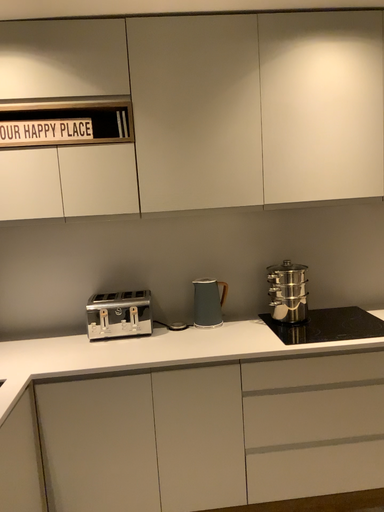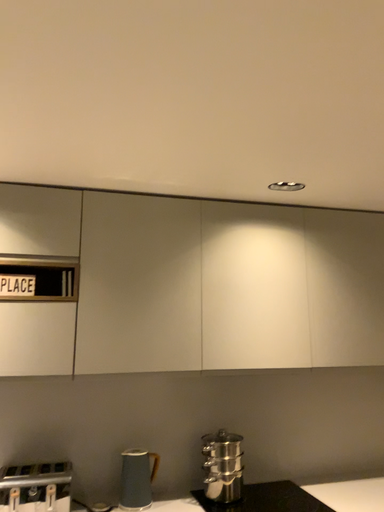
Question: Which way did the camera rotate in the video?

Choices:
 (A) rotated left
 (B) rotated right

Answer: (B)